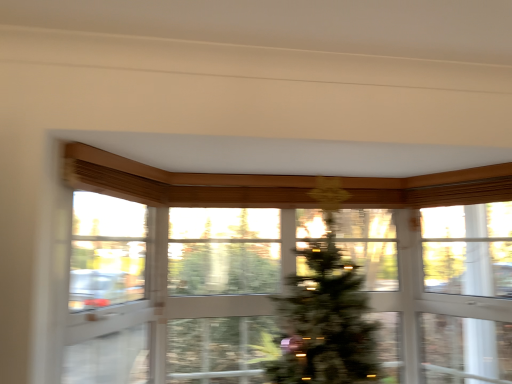
Question: Considering the positions of point (318, 317) and point (241, 283), is point (318, 317) closer or farther from the camera than point (241, 283)?

Choices:
 (A) closer
 (B) farther

Answer: (A)

Question: Considering the relative positions of green matte christmas tree at center and transparent glass window at center in the image provided, is green matte christmas tree at center to the left or to the right of transparent glass window at center?

Choices:
 (A) left
 (B) right

Answer: (A)

Question: Which object is positioned closest to the transparent glass window screen at upper right?

Choices:
 (A) green matte christmas tree at center
 (B) transparent glass window at center
 (C) transparent glass screen door at left

Answer: (B)

Question: Which of these objects is positioned farthest from the green matte christmas tree at center?

Choices:
 (A) transparent glass window at center
 (B) transparent glass window screen at upper right
 (C) transparent glass screen door at left

Answer: (B)